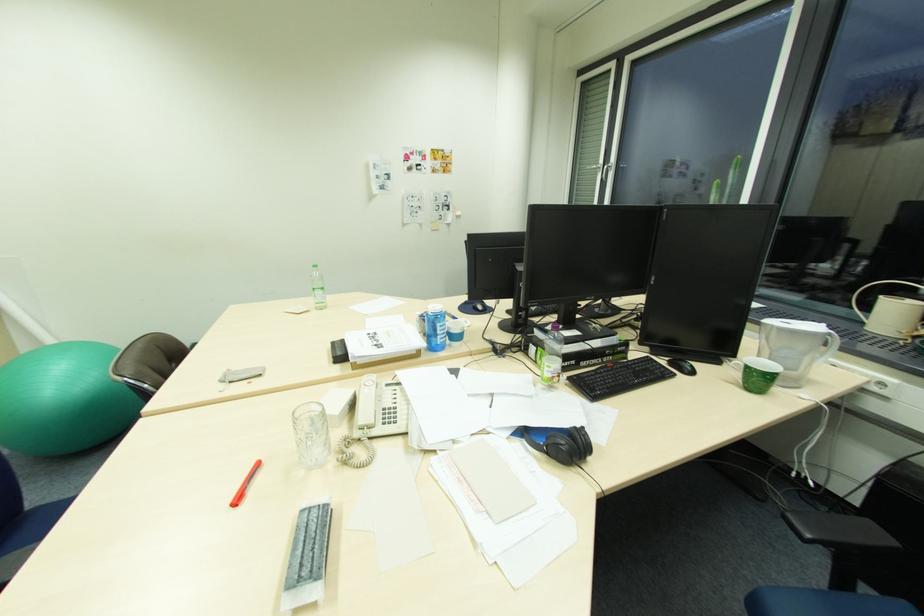
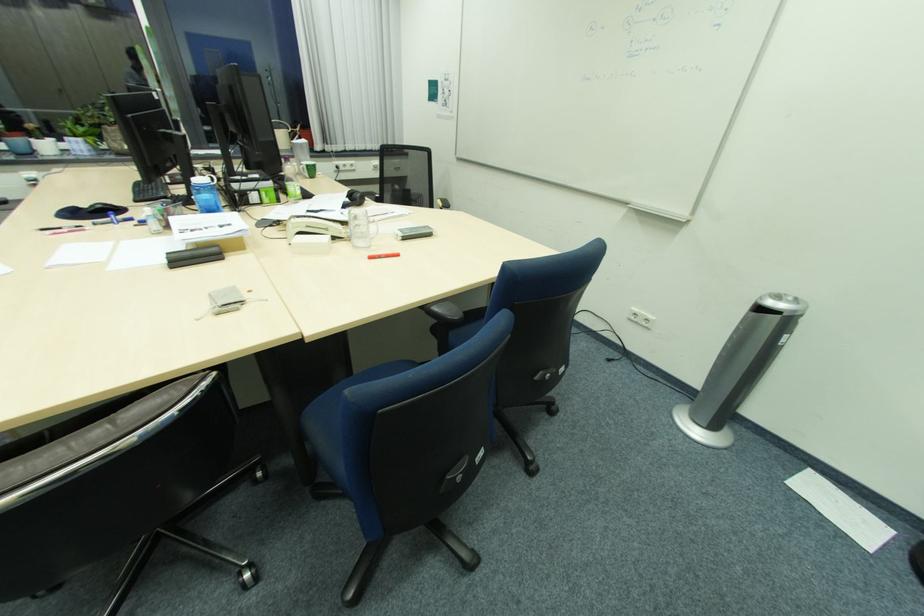
Where in the second image is the point corresponding to the point at 264,464 from the first image?

(377, 257)